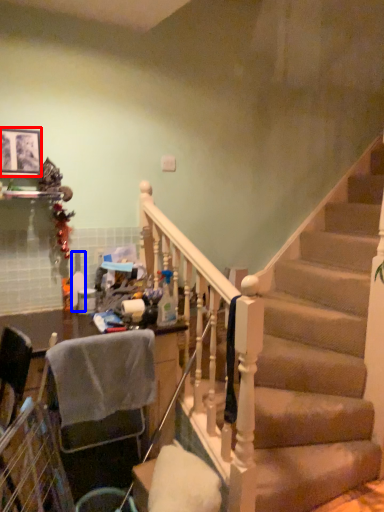
Question: Which of the following is the closest to the observer, picture frame (highlighted by a red box) or bottle (highlighted by a blue box)?

Choices:
 (A) picture frame
 (B) bottle

Answer: (A)